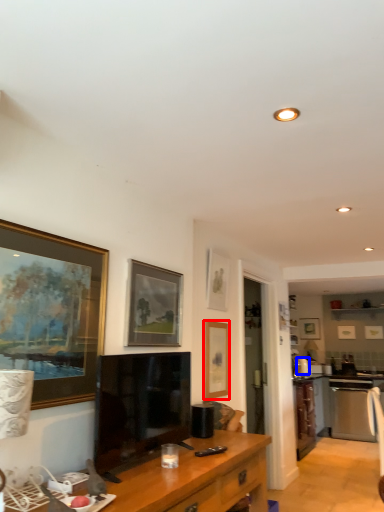
Question: Which object appears closest to the camera in this image, picture frame (highlighted by a red box) or appliance (highlighted by a blue box)?

Choices:
 (A) picture frame
 (B) appliance

Answer: (A)